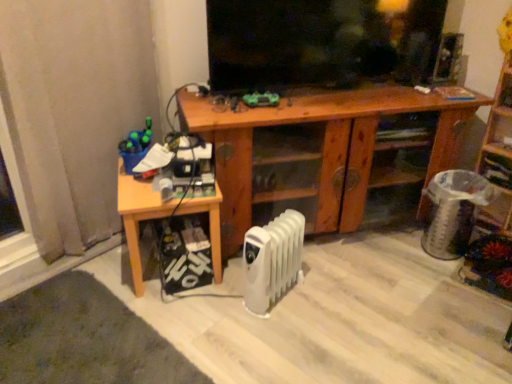
Where is `vacant area that lies to the right of green matte toy at center, placed as the first toy when sorted from top to bottom`? The width and height of the screenshot is (512, 384). vacant area that lies to the right of green matte toy at center, placed as the first toy when sorted from top to bottom is located at coordinates (301, 103).